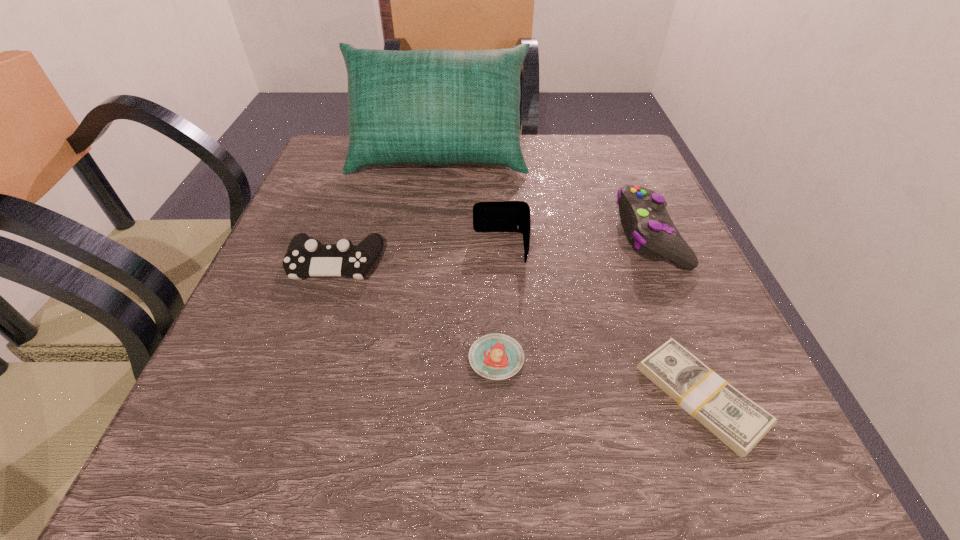
The width and height of the screenshot is (960, 540). I want to click on the tallest object, so click(434, 107).

Image resolution: width=960 pixels, height=540 pixels. I want to click on cushion, so click(x=434, y=107).

Find the location of a particular element. the right control is located at coordinates (644, 217).

I want to click on wallet, so click(x=502, y=216).

This screenshot has height=540, width=960. What are the coordinates of `the shorter control` in the screenshot? It's located at (305, 257).

I want to click on the left control, so click(305, 257).

Find the location of a particular element. the fifth tallest object is located at coordinates [495, 356].

What are the coordinates of `dollar` in the screenshot? It's located at (737, 421).

The image size is (960, 540). I want to click on free region located on the front-facing side of the cushion, so click(x=431, y=217).

Find the location of a particular element. Image resolution: width=960 pixels, height=540 pixels. vacant space located on the front of the right control is located at coordinates (751, 474).